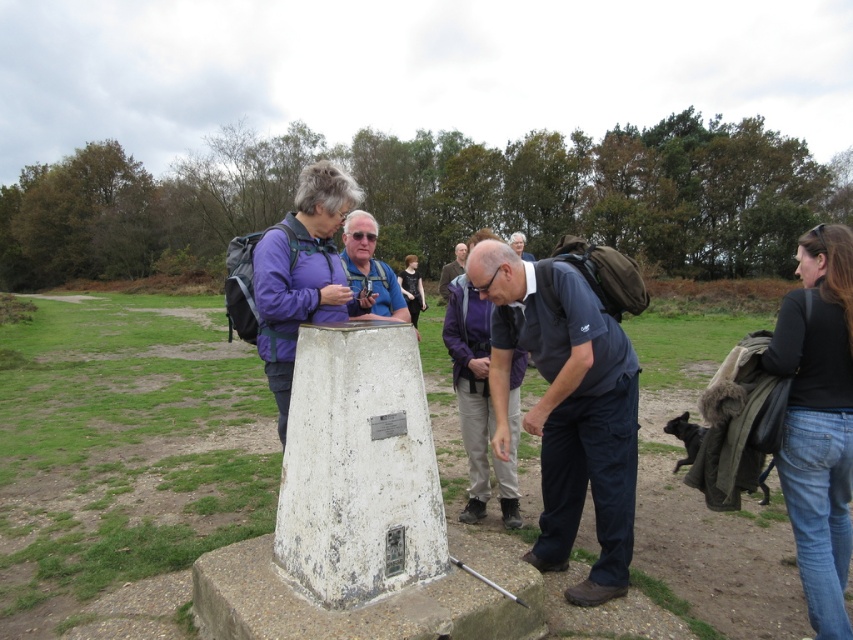
Does black denim jeans at lower right appear over dark brown hair at center?

Actually, black denim jeans at lower right is below dark brown hair at center.

Where is `black denim jeans at lower right`? Image resolution: width=853 pixels, height=640 pixels. black denim jeans at lower right is located at coordinates click(x=817, y=420).

Which is above, white concrete cone at center or purple fabric jacket at center?

Positioned higher is purple fabric jacket at center.

Is white concrete cone at center above purple fabric jacket at center?

Actually, white concrete cone at center is below purple fabric jacket at center.

Which is in front, point (292, 426) or point (325, 312)?

Point (292, 426) is in front.

Find the location of a particular element. The height and width of the screenshot is (640, 853). white concrete cone at center is located at coordinates (358, 467).

Who is positioned more to the left, black denim jeans at lower right or dark brown leather jacket at center?

dark brown leather jacket at center

Does black denim jeans at lower right have a lesser height compared to dark brown leather jacket at center?

Yes.

This screenshot has height=640, width=853. What do you see at coordinates (817, 420) in the screenshot?
I see `black denim jeans at lower right` at bounding box center [817, 420].

You are a GUI agent. You are given a task and a screenshot of the screen. Output one action in this format:
    pyautogui.click(x=<x>, y=<y>)
    Task: Click on the black denim jeans at lower right
    The height and width of the screenshot is (640, 853).
    Given the screenshot: What is the action you would take?
    pyautogui.click(x=817, y=420)